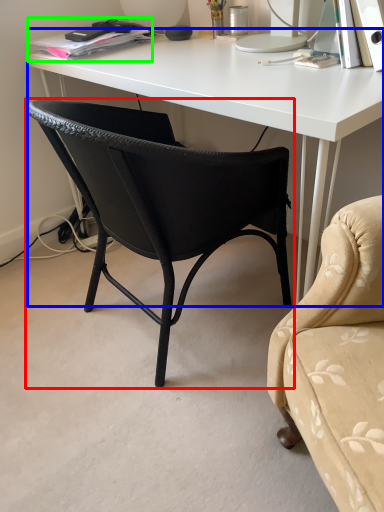
Question: Which object is positioned closest to chair (highlighted by a red box)? Select from desk (highlighted by a blue box) and book (highlighted by a green box).

Choices:
 (A) desk
 (B) book

Answer: (A)